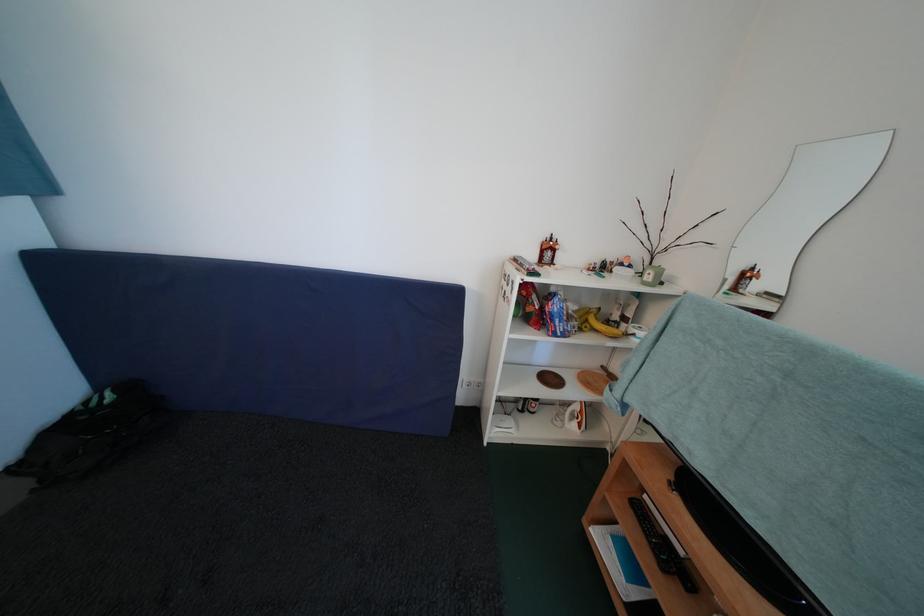
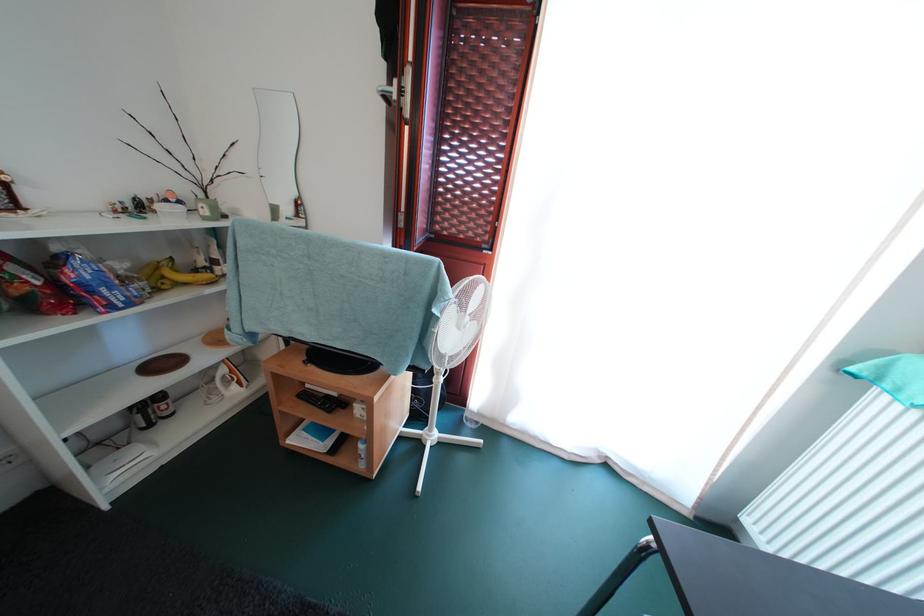
The point at (577, 322) is marked in the first image. Where is the corresponding point in the second image?

(131, 285)